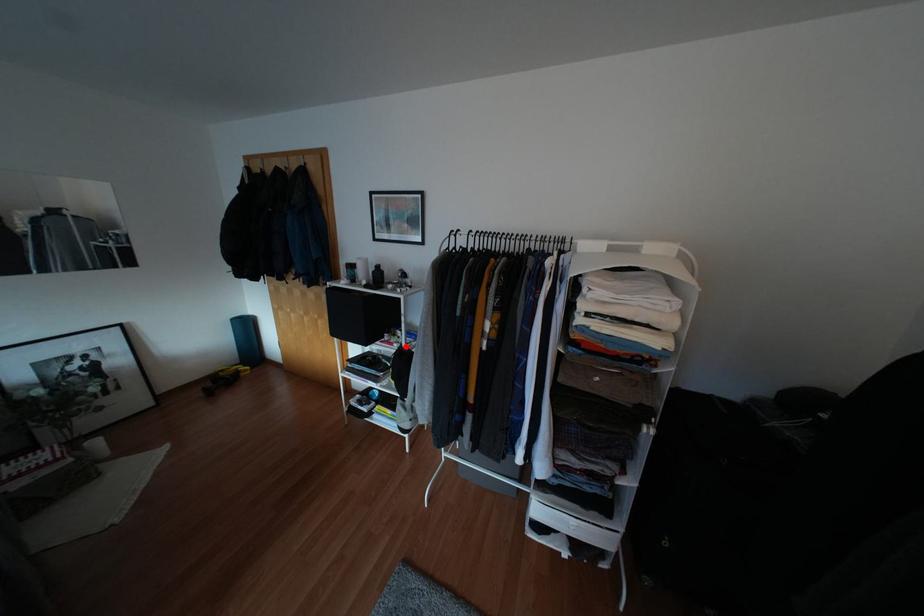
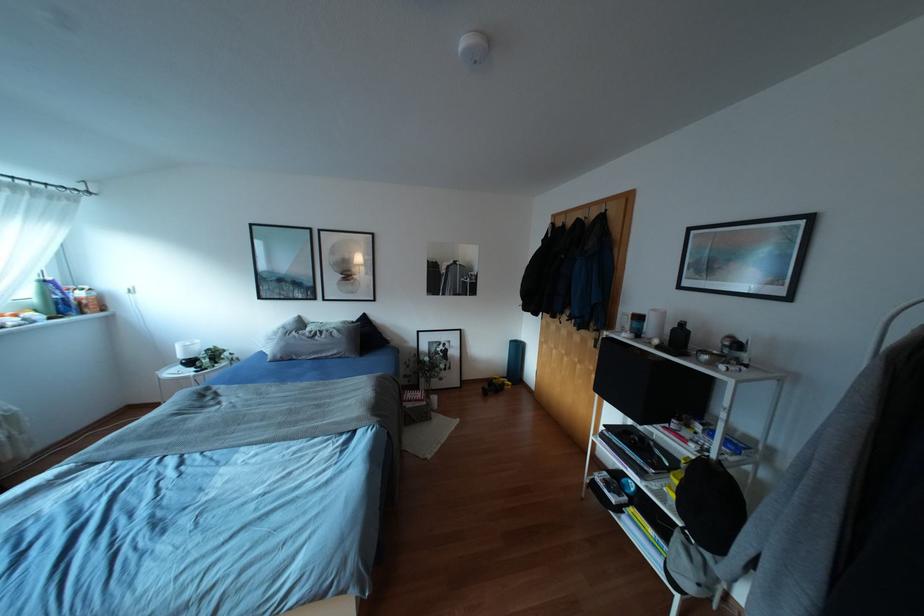
Question: I am providing you with two images of the same scene from different viewpoints. In image1, a red point is highlighted. Considering the same 3D point in image2, which of the following is correct?

Choices:
 (A) It is closer
 (B) It is farther

Answer: (A)